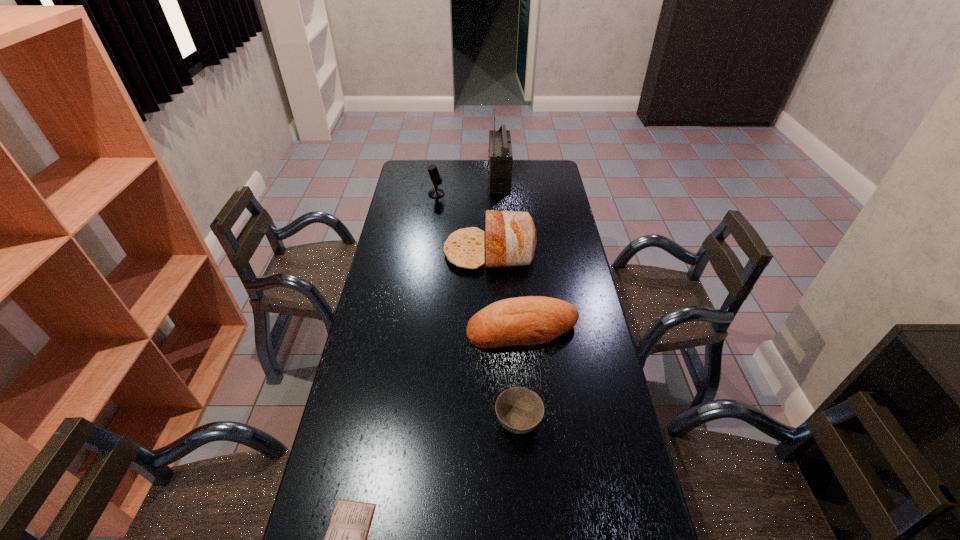
Find the location of a particular element. Image resolution: width=960 pixels, height=540 pixels. radio receiver is located at coordinates [500, 155].

Image resolution: width=960 pixels, height=540 pixels. I want to click on the taller bread, so click(x=511, y=237).

Find the location of a particular element. This screenshot has height=540, width=960. the third farthest object is located at coordinates (511, 237).

This screenshot has width=960, height=540. What are the coordinates of `microphone` in the screenshot? It's located at (436, 178).

This screenshot has height=540, width=960. I want to click on the fourth farthest object, so click(x=532, y=320).

The width and height of the screenshot is (960, 540). In order to click on the nearer bread in this screenshot , I will do `click(532, 320)`.

This screenshot has width=960, height=540. In order to click on bowl in this screenshot , I will do `click(519, 410)`.

Find the location of a particular element. The height and width of the screenshot is (540, 960). the second nearest object is located at coordinates (519, 410).

Where is `vacant space located 0.400m on the front panel of the radio receiver`? The height and width of the screenshot is (540, 960). vacant space located 0.400m on the front panel of the radio receiver is located at coordinates click(x=410, y=179).

Image resolution: width=960 pixels, height=540 pixels. I want to click on vacant point located 0.290m on the front panel of the radio receiver, so click(x=431, y=179).